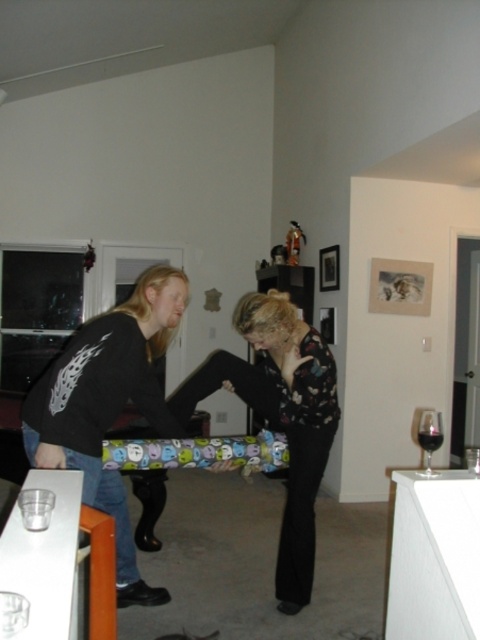
You are a bartender preparing a drink. You have a transparent glass at right and a dark glass wine at lower right. Can you pour wine into the transparent glass without spilling, considering their positions?

The transparent glass at right and dark glass wine at lower right are 1.37 inches apart from each other. Since the distance between them is only 1.37 inches, pouring wine directly between them may cause spillage. You should move the transparent glass at right further away from the dark glass wine at lower right to ensure enough space for pouring without spilling.

You are standing in the living room and want to place a small vase exactly where the matte black shirt at center is located. Is this position suitable for placing the vase?

The matte black shirt at center is located at point (202, 397), so placing the vase there would require removing the shirt first as the position is currently occupied by the shirt.

You are standing in the living room and see a point marked at coordinates [56,464]. If you want to place a 1.5 meter long sofa in the room, can you position it so that the sofa extends from your current position to that point?

The point at [56,464] is 2.00 meters away from you, so yes, you can position the 1.5 meter long sofa from your current position to that point since the distance is sufficient.